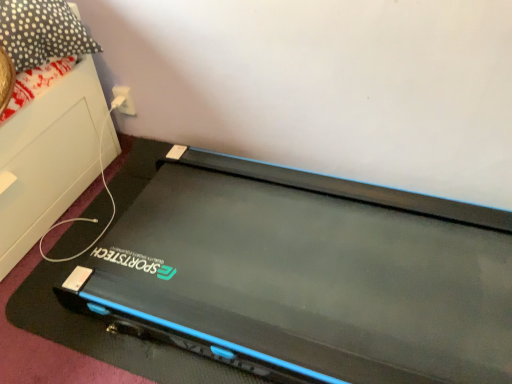
Question: From a real-world perspective, is polka dot fabric pillow at upper left above or below black matte treadmill at center?

Choices:
 (A) above
 (B) below

Answer: (A)

Question: In the image, is polka dot fabric pillow at upper left on the left side or the right side of black matte treadmill at center?

Choices:
 (A) right
 (B) left

Answer: (B)

Question: Considering the real-world distances, which object is farthest from the polka dot fabric pillow at upper left?

Choices:
 (A) black matte treadmill at center
 (B) white plastic at upper center

Answer: (A)

Question: Which of these objects is positioned closest to the polka dot fabric pillow at upper left?

Choices:
 (A) black matte treadmill at center
 (B) white plastic at upper center

Answer: (B)